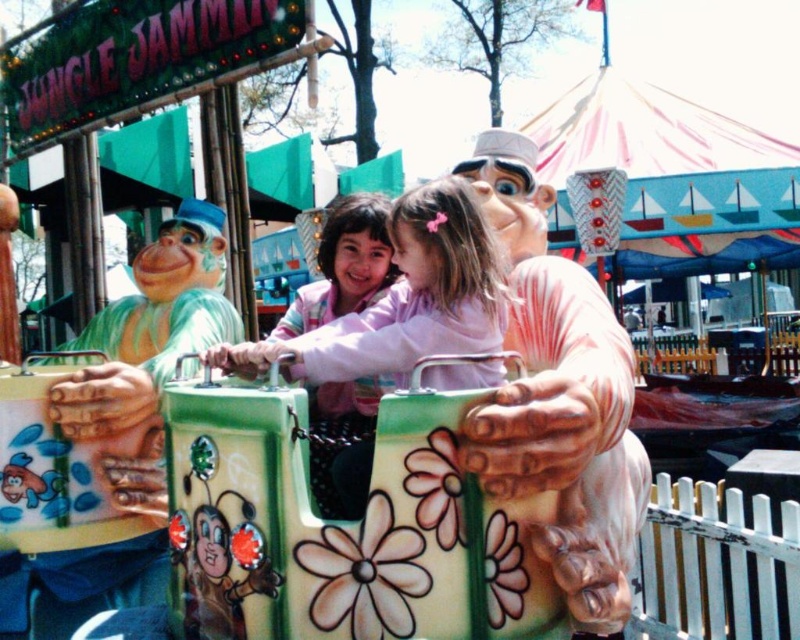
You are a parent trying to decide whether to let your child sit on the Jungle Jammin ride. You notice the matte pink plush monkey at center and the pink matte jacket at center. Which object is bigger and might be more noticeable to your child?

The matte pink plush monkey at center is larger in size than the pink matte jacket at center, so it would be more noticeable to the child.

You are standing at the fairground looking at the Jungle Jammin ride. There are two points marked on the ride, point (600, 477) and point (432, 273). Which point is closer to you?

Point (600, 477) is closer to the camera than point (432, 273).

You are standing at the entrance of the Jungle Jammin ride and want to find the matte pink plush monkey at center. According to the coordinates provided, where should you look to locate it?

The matte pink plush monkey at center is located at coordinates point [560,396].